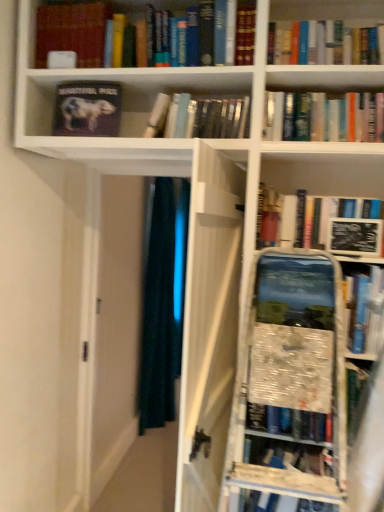
Question: Can you confirm if matte black book at upper left, the 2th book positioned from the left, is positioned to the right of hardcover book at upper center, the fourth book from the left?

Choices:
 (A) no
 (B) yes

Answer: (A)

Question: Would you say matte black book at upper left, acting as the third book starting from the right, contains hardcover book at upper center, the fourth book from the left?

Choices:
 (A) yes
 (B) no

Answer: (B)

Question: Considering the relative sizes of matte black book at upper left, acting as the third book starting from the right, and hardcover book at upper center, the fourth book from the left, in the image provided, is matte black book at upper left, acting as the third book starting from the right, taller than hardcover book at upper center, the fourth book from the left,?

Choices:
 (A) no
 (B) yes

Answer: (B)

Question: Does matte black book at upper left, acting as the third book starting from the right, have a smaller size compared to hardcover book at upper center, the fourth book from the left?

Choices:
 (A) yes
 (B) no

Answer: (A)

Question: Is the position of matte black book at upper left, acting as the third book starting from the right, less distant than that of hardcover book at upper center, the fourth book from the left?

Choices:
 (A) no
 (B) yes

Answer: (A)

Question: Do you think dark blue fabric at center is within hardcover book at upper center, which is counted as the 1th book, starting from the right, or outside of it?

Choices:
 (A) inside
 (B) outside

Answer: (B)

Question: Considering the positions of dark blue fabric at center and hardcover book at upper center, the fourth book from the left, in the image, is dark blue fabric at center bigger or smaller than hardcover book at upper center, the fourth book from the left,?

Choices:
 (A) small
 (B) big

Answer: (B)

Question: Considering their positions, is dark blue fabric at center located in front of or behind hardcover book at upper center, which is counted as the 1th book, starting from the right?

Choices:
 (A) behind
 (B) front

Answer: (A)

Question: From the image's perspective, is dark blue fabric at center positioned above or below hardcover book at upper center, which is counted as the 1th book, starting from the right?

Choices:
 (A) below
 (B) above

Answer: (A)

Question: From the image's perspective, is black matte book at upper right positioned above or below dark blue fabric at center?

Choices:
 (A) above
 (B) below

Answer: (A)

Question: Is black matte book at upper right situated inside dark blue fabric at center or outside?

Choices:
 (A) inside
 (B) outside

Answer: (B)

Question: Is black matte book at upper right taller or shorter than dark blue fabric at center?

Choices:
 (A) tall
 (B) short

Answer: (B)

Question: From a real-world perspective, is black matte book at upper right positioned above or below dark blue fabric at center?

Choices:
 (A) below
 (B) above

Answer: (B)

Question: Considering the positions of hardcover book at upper center, the fourth book from the left, and matte black book at upper left, acting as the third book starting from the right, in the image, is hardcover book at upper center, the fourth book from the left, wider or thinner than matte black book at upper left, acting as the third book starting from the right,?

Choices:
 (A) thin
 (B) wide

Answer: (B)

Question: From the image's perspective, relative to matte black book at upper left, acting as the third book starting from the right, is hardcover book at upper center, the fourth book from the left, above or below?

Choices:
 (A) above
 (B) below

Answer: (A)